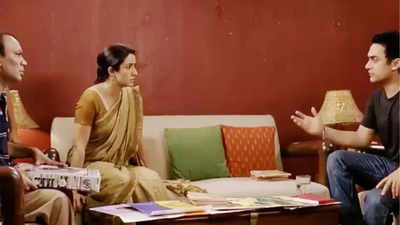
The height and width of the screenshot is (225, 400). I want to click on lamp shades, so click(x=341, y=100), click(x=21, y=118).